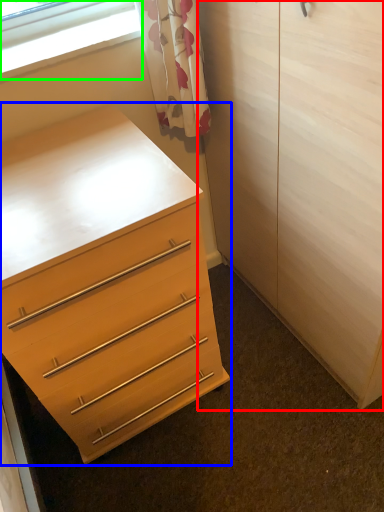
Question: Which is farther away from armoire (highlighted by a red box)? chest of drawers (highlighted by a blue box) or window (highlighted by a green box)?

Choices:
 (A) chest of drawers
 (B) window

Answer: (B)